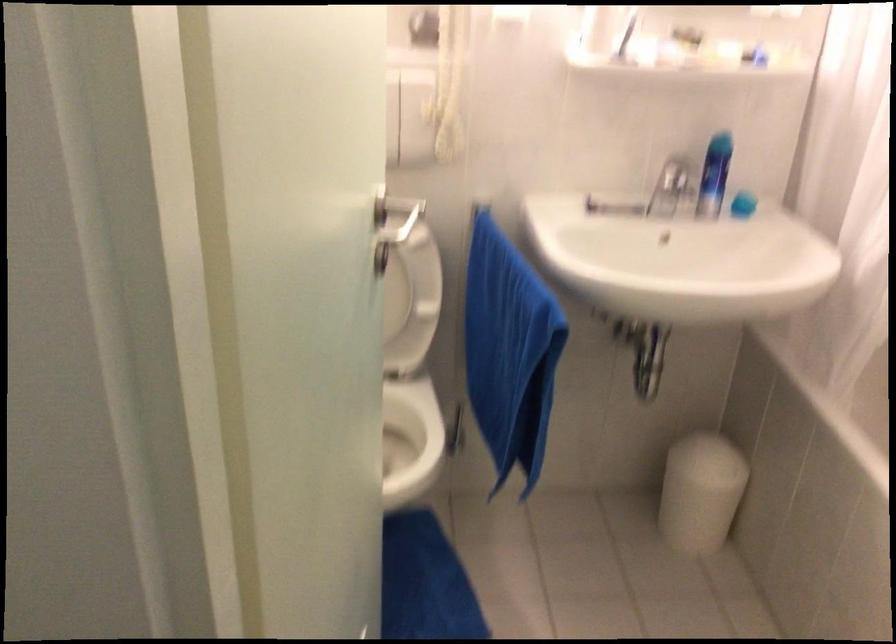
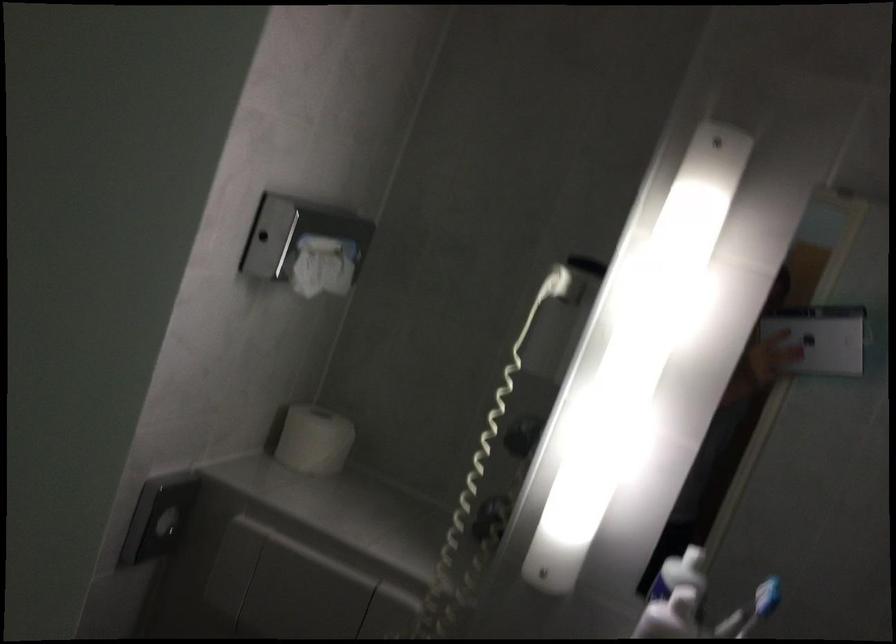
The first image is from the beginning of the video and the second image is from the end. How did the camera likely rotate when shooting the video?

The camera rotated toward left-up.